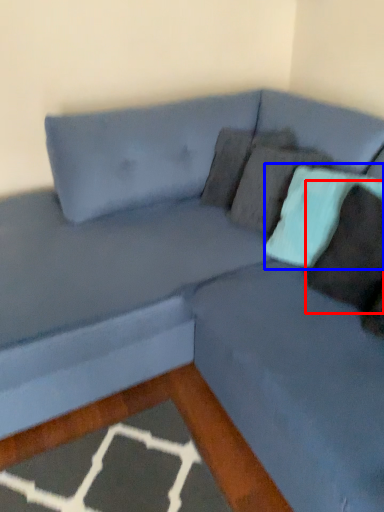
Question: Among these objects, which one is nearest to the camera, pillow (highlighted by a red box) or pillow (highlighted by a blue box)?

Choices:
 (A) pillow
 (B) pillow

Answer: (A)